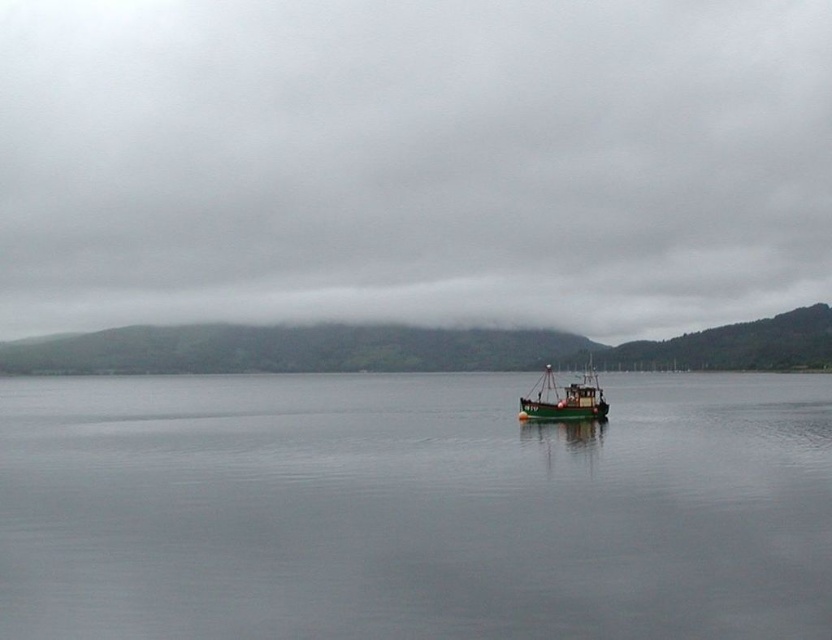
Does point (167, 266) come in front of point (370, 512)?

No, (167, 266) is further to viewer.

In the scene shown: Is cloudy sky at center positioned in front of green matte water at center?

That is False.

Find the location of a particular element. Image resolution: width=832 pixels, height=640 pixels. cloudy sky at center is located at coordinates (414, 163).

Describe the element at coordinates (414, 509) in the screenshot. I see `green matte water at center` at that location.

In the scene shown: How distant is green matte water at center from green matte boat at center?

The distance of green matte water at center from green matte boat at center is 57.49 meters.

Find the location of a particular element. This screenshot has width=832, height=640. green matte water at center is located at coordinates (414, 509).

You are a GUI agent. You are given a task and a screenshot of the screen. Output one action in this format:
    pyautogui.click(x=<x>, y=<y>)
    Task: Click on the green matte water at center
    
    Given the screenshot: What is the action you would take?
    pyautogui.click(x=414, y=509)

Does cloudy sky at center appear under green matte boat at center?

Incorrect, cloudy sky at center is not positioned below green matte boat at center.

What do you see at coordinates (414, 163) in the screenshot?
I see `cloudy sky at center` at bounding box center [414, 163].

What do you see at coordinates (414, 163) in the screenshot? I see `cloudy sky at center` at bounding box center [414, 163].

What are the coordinates of `cloudy sky at center` in the screenshot? It's located at (414, 163).